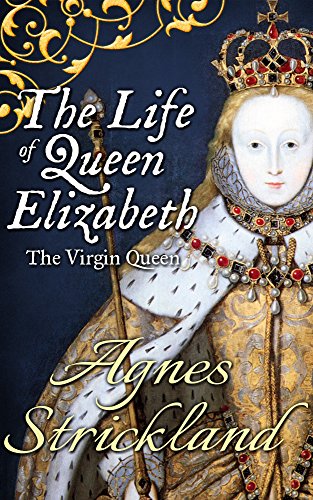
What are the coordinates of `painting of queen elizabeth` in the screenshot? It's located at (276, 109).